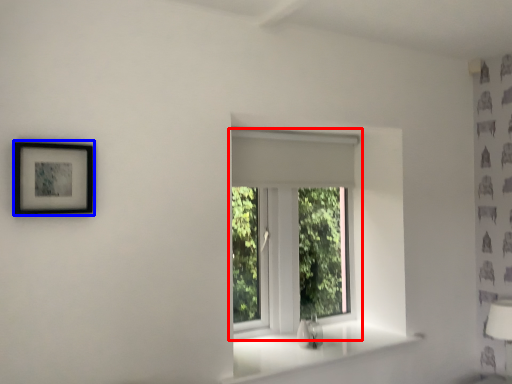
Question: Which object is further to the camera taking this photo, window (highlighted by a red box) or picture frame (highlighted by a blue box)?

Choices:
 (A) window
 (B) picture frame

Answer: (A)